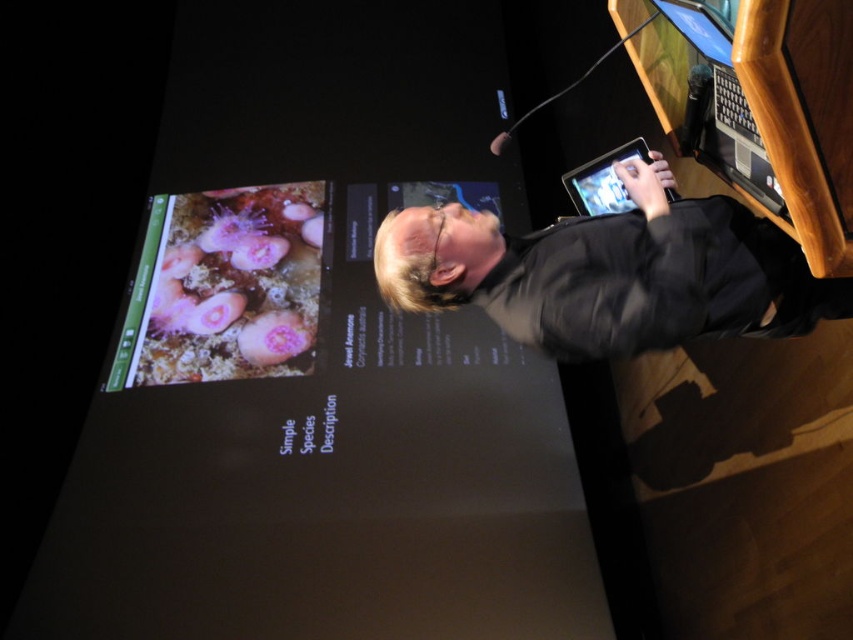
You are a photographer trying to capture a closeup of the slide displayed on the large screen during the presentation. You have two points marked on your camera viewfinder corresponding to the points in the image. Which of the two points, point (810, 285) or point (682, 84), is closer to your camera lens and thus would be more in focus if you focus on that point?

Answer: Point (810, 285) is closer to the camera than point (682, 84), so focusing on point (810, 285) would make it more in focus.

You are a photographer positioned at the camera. You want to capture a closeup shot of the black matte shirt at center. What is the minimum distance you need to move towards the shirt to get it in focus?

The black matte shirt at center is 1.26 meters away from camera. To capture a closeup shot, you need to move to within the minimum focusing distance of your lens. If your lens has a minimum focusing distance of, say, 0.5 meters, you would need to move closer until the shirt is within that range. However, without knowing the exact lens specifications, the shirt is currently 1.26 meters away.